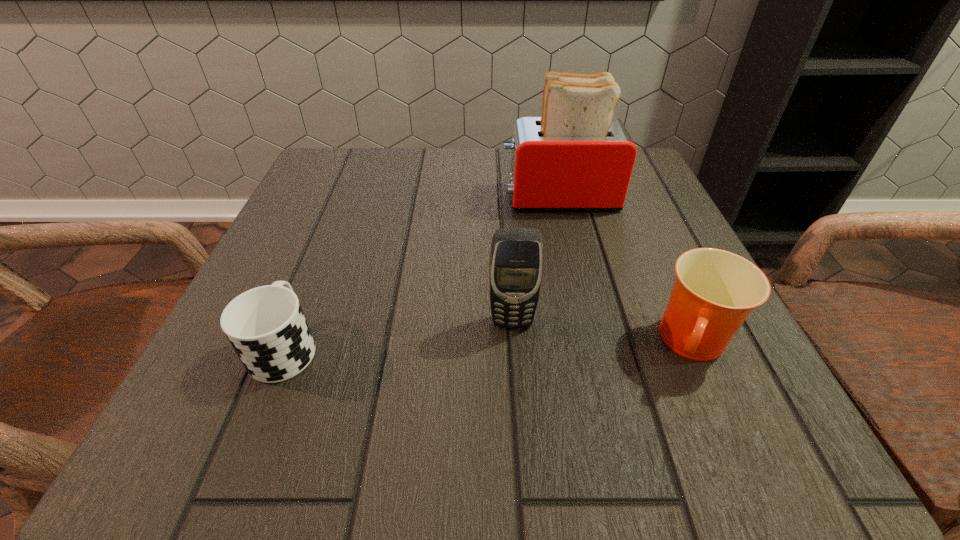
Find the location of a particular element. The image size is (960, 540). free spot located on the front face of the third shortest object is located at coordinates (515, 358).

Where is `free location located on the left of the right cup`? free location located on the left of the right cup is located at coordinates (493, 345).

You are a GUI agent. You are given a task and a screenshot of the screen. Output one action in this format:
    pyautogui.click(x=<x>, y=<y>)
    Task: Click on the vacant space located 0.340m on the side of the left cup with the handle
    The width and height of the screenshot is (960, 540).
    Given the screenshot: What is the action you would take?
    pyautogui.click(x=348, y=193)

The height and width of the screenshot is (540, 960). I want to click on free space located on the side of the left cup with the handle, so click(x=344, y=201).

At what (x,y) coordinates should I click in order to perform the action: click on vacant space located on the side of the left cup with the handle. Please return your answer as a coordinate pair (x, y). The image size is (960, 540). Looking at the image, I should click on (343, 204).

Find the location of a particular element. This screenshot has height=540, width=960. object at the far edge is located at coordinates (576, 157).

Locate an element on the screen. The width and height of the screenshot is (960, 540). object located in the left edge section of the desktop is located at coordinates (266, 326).

The image size is (960, 540). Find the location of `toaster present at the right edge`. toaster present at the right edge is located at coordinates (576, 157).

Find the location of a particular element. The image size is (960, 540). cup that is positioned at the right edge is located at coordinates (715, 290).

This screenshot has height=540, width=960. I want to click on object that is at the far right corner, so [576, 157].